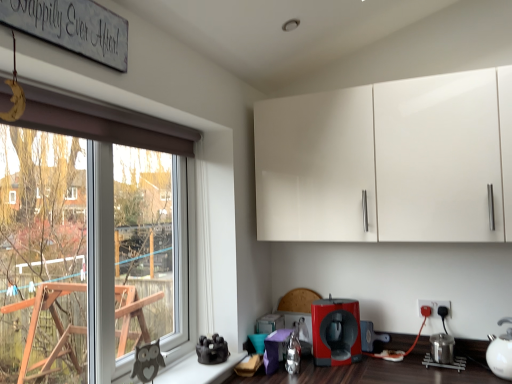
Question: Can we say matte red coffee machine at lower center, the second coffee machine from the right, lies outside matte red coffee machine at lower center, the 1th coffee machine in the right-to-left sequence?

Choices:
 (A) no
 (B) yes

Answer: (B)

Question: Is the depth of matte red coffee machine at lower center, acting as the first coffee machine starting from the front, less than that of matte red coffee machine at lower center, the 2th coffee machine positioned from the left?

Choices:
 (A) yes
 (B) no

Answer: (A)

Question: Considering the relative positions of matte red coffee machine at lower center, acting as the first coffee machine starting from the front, and matte red coffee machine at lower center, marked as the 2th coffee machine in a front-to-back arrangement, in the image provided, is matte red coffee machine at lower center, acting as the first coffee machine starting from the front, to the left of matte red coffee machine at lower center, marked as the 2th coffee machine in a front-to-back arrangement, from the viewer's perspective?

Choices:
 (A) yes
 (B) no

Answer: (A)

Question: Considering the relative sizes of matte red coffee machine at lower center, arranged as the second coffee machine when viewed from the back, and matte red coffee machine at lower center, which is counted as the 1th coffee machine, starting from the back, in the image provided, is matte red coffee machine at lower center, arranged as the second coffee machine when viewed from the back, taller than matte red coffee machine at lower center, which is counted as the 1th coffee machine, starting from the back,?

Choices:
 (A) yes
 (B) no

Answer: (A)

Question: Considering the relative sizes of matte red coffee machine at lower center, which is the 1th coffee machine in left-to-right order, and matte red coffee machine at lower center, the 2th coffee machine positioned from the left, in the image provided, is matte red coffee machine at lower center, which is the 1th coffee machine in left-to-right order, smaller than matte red coffee machine at lower center, the 2th coffee machine positioned from the left,?

Choices:
 (A) yes
 (B) no

Answer: (B)

Question: From the image's perspective, is matte red coffee machine at lower center, acting as the first coffee machine starting from the front, below matte red coffee machine at lower center, the 1th coffee machine in the right-to-left sequence?

Choices:
 (A) yes
 (B) no

Answer: (B)

Question: Does matte red coffee machine at lower center, the 1th coffee machine in the right-to-left sequence, lie in front of matte red coffee machine at lower center, the second coffee machine from the right?

Choices:
 (A) no
 (B) yes

Answer: (A)

Question: Is matte red coffee machine at lower center, which is counted as the 1th coffee machine, starting from the back, surrounding matte red coffee machine at lower center, which is the 1th coffee machine in left-to-right order?

Choices:
 (A) yes
 (B) no

Answer: (B)

Question: Is matte red coffee machine at lower center, which is counted as the 1th coffee machine, starting from the back, looking in the opposite direction of matte red coffee machine at lower center, the second coffee machine from the right?

Choices:
 (A) yes
 (B) no

Answer: (B)

Question: Can you confirm if matte red coffee machine at lower center, marked as the 2th coffee machine in a front-to-back arrangement, is thinner than matte red coffee machine at lower center, the second coffee machine from the right?

Choices:
 (A) no
 (B) yes

Answer: (B)

Question: Can you confirm if matte red coffee machine at lower center, the 2th coffee machine positioned from the left, is wider than matte red coffee machine at lower center, arranged as the second coffee machine when viewed from the back?

Choices:
 (A) yes
 (B) no

Answer: (B)

Question: Is matte red coffee machine at lower center, marked as the 2th coffee machine in a front-to-back arrangement, in contact with matte red coffee machine at lower center, the second coffee machine from the right?

Choices:
 (A) yes
 (B) no

Answer: (B)

Question: Is wooden signboard at upper left at the left side of matte black electric outlet at lower right?

Choices:
 (A) yes
 (B) no

Answer: (A)